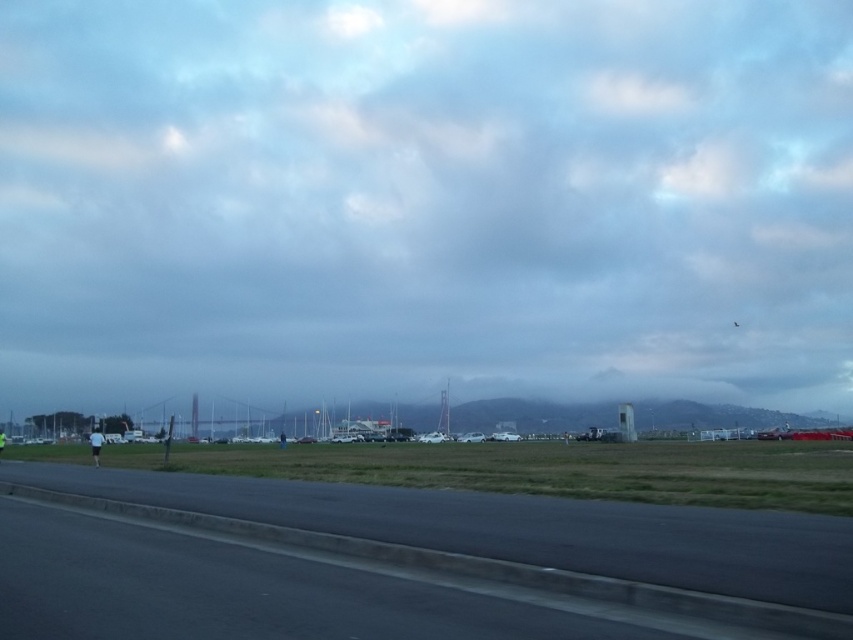
You are a pilot preparing for takeoff and see the cloudy sky at upper center and the black asphalt runway at lower left. Based on their positions, which object is located to the right of the other?

The cloudy sky at upper center is positioned on the right side of black asphalt runway at lower left.

You are standing at the point with coordinates point (682, 552) and want to walk to the point with coordinates point (229, 240). Which direction should you face to walk directly towards your destination?

You should face the direction towards point (229, 240) because it is behind point (682, 552), so walking towards it would require facing backwards relative to your current position.